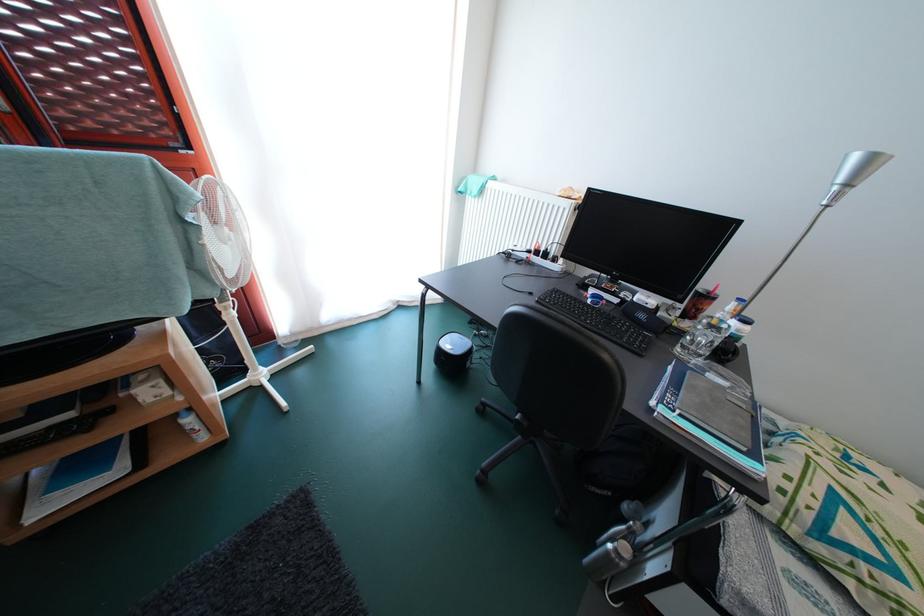
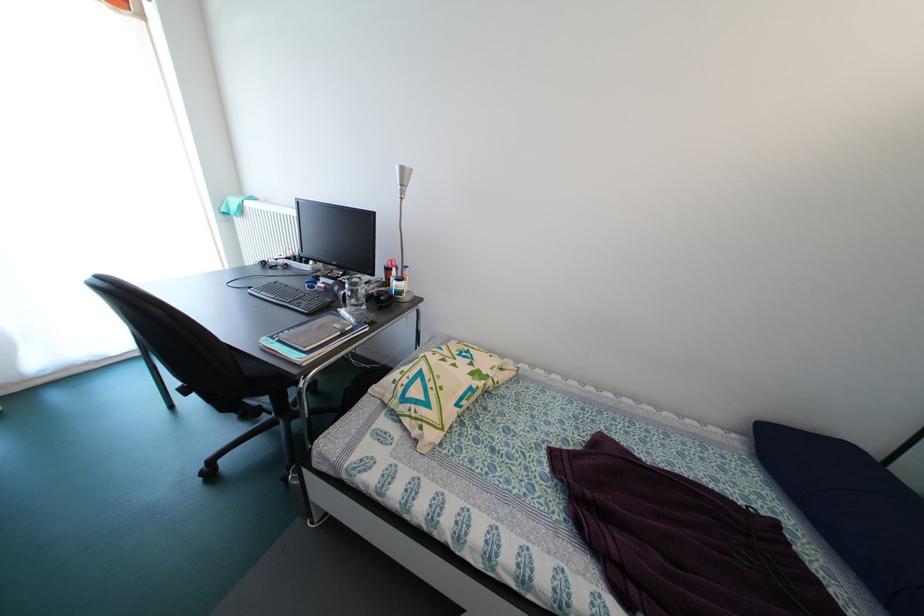
Find the pixel in the second image that matches point 710,361 in the first image.

(362, 310)